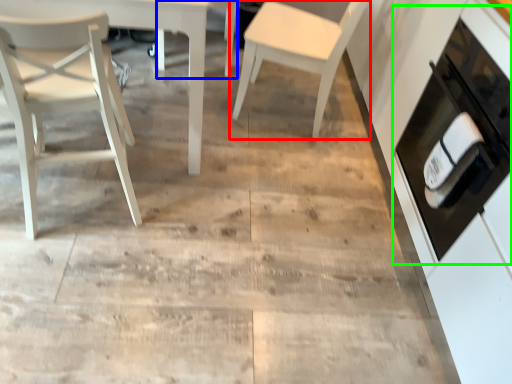
Question: Which object is the farthest from chair (highlighted by a red box)? Choose among these: chair (highlighted by a blue box) or cabinetry (highlighted by a green box).

Choices:
 (A) chair
 (B) cabinetry

Answer: (B)